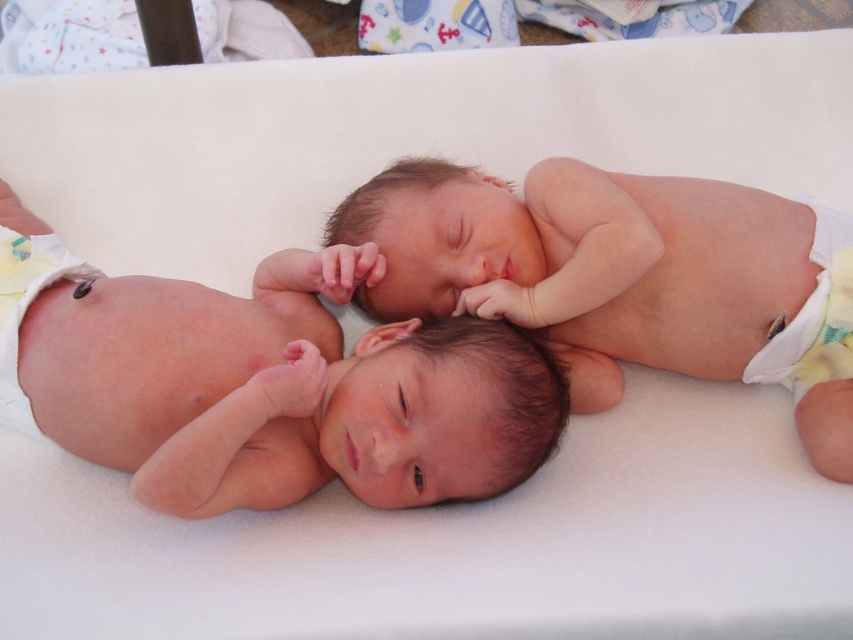
Can you confirm if white cloth diaper at right is bigger than white cloth diaper at left?

Actually, white cloth diaper at right might be smaller than white cloth diaper at left.

Does white cloth diaper at right appear on the left side of white cloth diaper at left?

In fact, white cloth diaper at right is to the right of white cloth diaper at left.

Is point (805, 385) in front of point (20, 305)?

That is False.

Image resolution: width=853 pixels, height=640 pixels. I want to click on white cloth diaper at right, so click(x=814, y=317).

From the picture: Is pink smooth skin at center closer to camera compared to white cloth diaper at left?

Yes, pink smooth skin at center is closer to the viewer.

Is point (271, 362) positioned behind point (28, 264)?

That is False.

I want to click on pink smooth skin at center, so click(263, 381).

The height and width of the screenshot is (640, 853). In order to click on smooth skin newborn at center in this screenshot , I will do `click(625, 276)`.

In the scene shown: Can you confirm if smooth skin newborn at center is positioned below white cloth diaper at right?

Actually, smooth skin newborn at center is above white cloth diaper at right.

Who is more distant from viewer, [602,348] or [836,298]?

Positioned behind is point [602,348].

I want to click on smooth skin newborn at center, so click(625, 276).